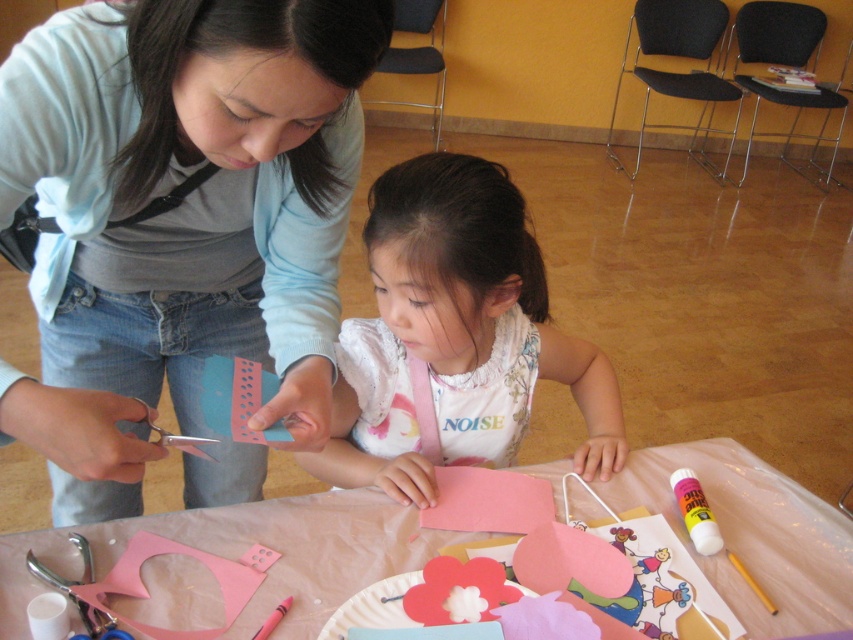
You are standing in front of the crafting table and need to reach two points on the table. The first point is at coordinate point(122, 502) and the second is at point(451, 349). Which point is closer to you?

Point(122, 502) is closer to you because it is further to the viewer than point(451, 349).

You are observing a crafting session where two people are working at a table. You notice the matte blue card at center and the pink paper at center. Which object is nearer to you?

The matte blue card at center is closer to the viewer than the pink paper at center.

You are organizing a craft fair and need to know if the matte blue card at center can fully cover the white cotton shirt at center when placed over it. Based on their sizes, what do you think?

The matte blue card at center is larger in size than the white cotton shirt at center, so it can fully cover it.